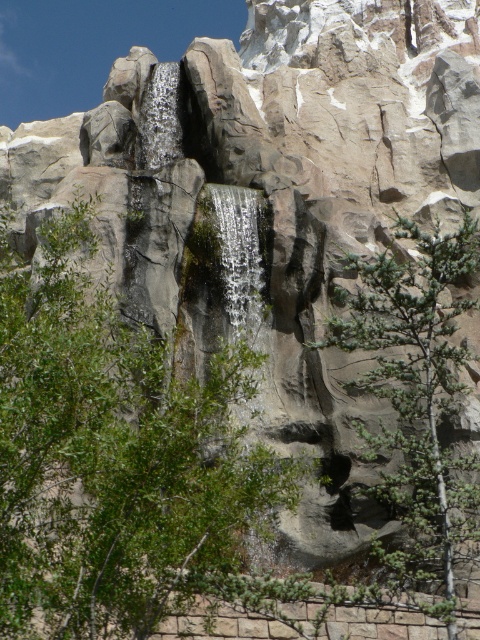
You are a hiker who wants to take a photo of both the green leafy tree at center and the green textured tree at center. Since you are standing at the base of the cliff, which tree should you focus on first to ensure both are in the frame?

The green leafy tree at center is positioned under the green textured tree at center, so you should focus on the green textured tree at center first to ensure both are in the frame.

You are standing at the origin point of the coordinate system. You want to reach the green leafy tree at center. Which direction should you move in to reach it?

The green leafy tree at center is located at coordinate point 0.714 on the x axis and 0.240 on the y axis. Since the origin is at the bottom left corner of the image, you should move to the right and slightly upwards to reach the green leafy tree at center.

You are a hiker standing at the base of the cliff and looking up. You see the green leafy tree at center and the green textured tree at center. Which tree is closer to you?

The green leafy tree at center is closer to you because it is in front of the green textured tree at center.